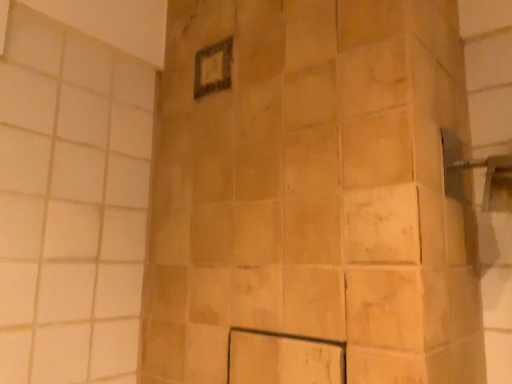
Image resolution: width=512 pixels, height=384 pixels. What do you see at coordinates (213, 68) in the screenshot? I see `matte black frame at upper center` at bounding box center [213, 68].

At what (x,y) coordinates should I click in order to perform the action: click on matte black frame at upper center. Please return your answer as a coordinate pair (x, y). The width and height of the screenshot is (512, 384). Looking at the image, I should click on coord(213,68).

The height and width of the screenshot is (384, 512). Identify the location of matte black frame at upper center. (213, 68).